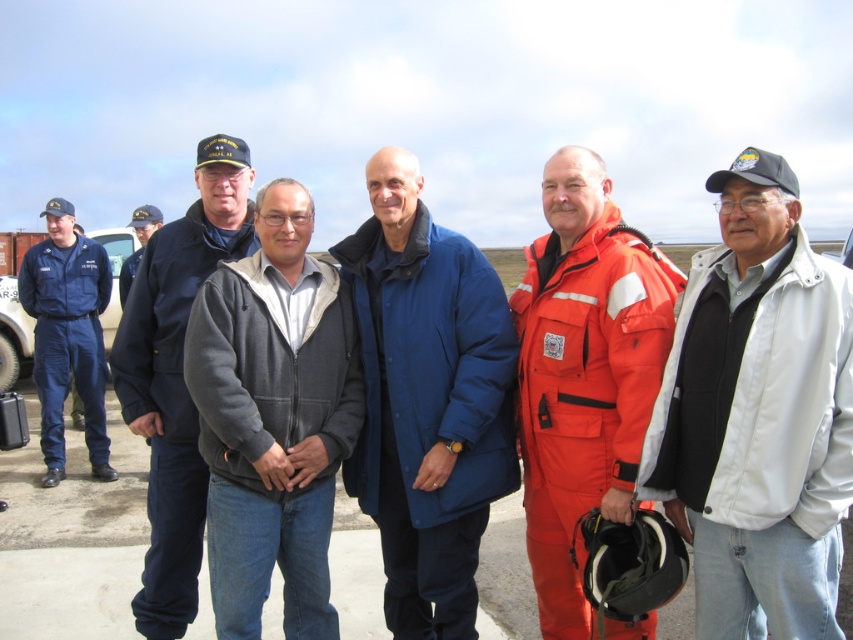
Is the position of blue matte jacket at center less distant than that of orange fabric jumpsuit at center?

No, it is not.

Who is more distant from viewer, (486, 316) or (589, 440)?

The point (486, 316) is behind.

Image resolution: width=853 pixels, height=640 pixels. Identify the location of blue matte jacket at center. (427, 401).

Between gray fleece jacket at center and orange fabric jumpsuit at center, which one has more height?

With more height is orange fabric jumpsuit at center.

Is point (229, 630) positioned behind point (556, 244)?

No, it is not.

Is point (309, 403) positioned in front of point (645, 508)?

No.

Locate an element on the screen. gray fleece jacket at center is located at coordinates (273, 419).

Who is more forward, [309,468] or [125,355]?

Point [309,468] is more forward.

Who is positioned more to the left, gray fleece jacket at center or navy blue jacket at center?

From the viewer's perspective, navy blue jacket at center appears more on the left side.

Describe the element at coordinates (273, 419) in the screenshot. This screenshot has height=640, width=853. I see `gray fleece jacket at center` at that location.

Identify the location of gray fleece jacket at center. (273, 419).